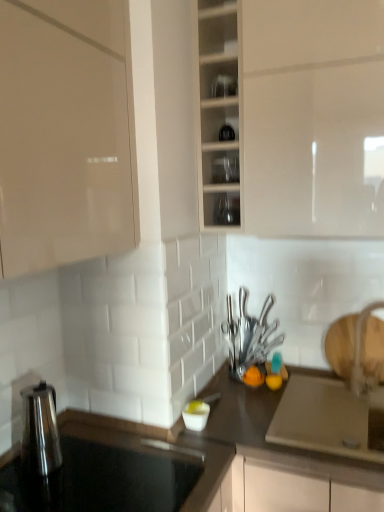
This screenshot has height=512, width=384. In order to click on vacant area to the right of white glossy bowl at center, the third tableware from the right in this screenshot , I will do `click(253, 421)`.